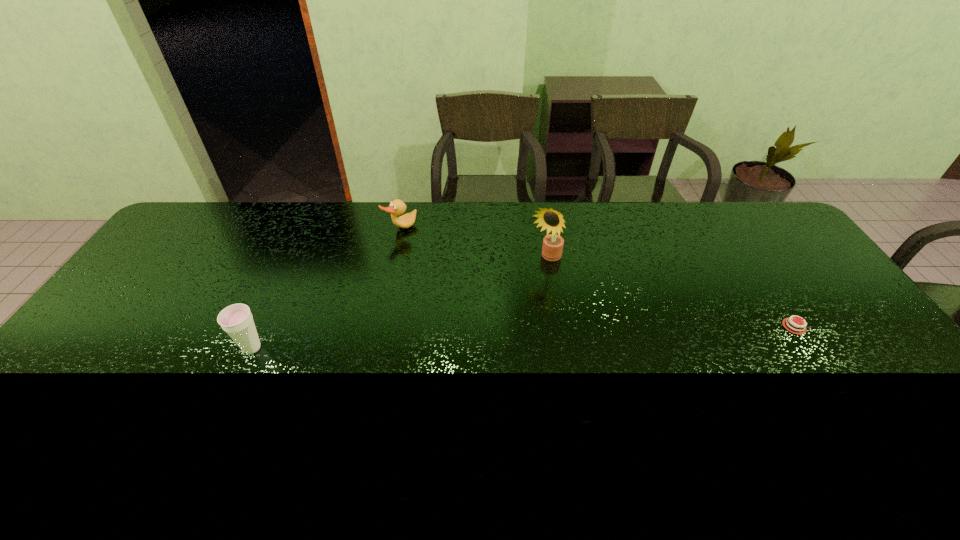
Identify the location of free spot on the desktop that is between the leftmost object and the rightmost object and is positioned on the face of the sunflower. (483, 339).

What are the coordinates of `vacant space on the desktop that is between the cup and the shortest object and is positioned on the beak of the third object from right to left` in the screenshot? It's located at (519, 338).